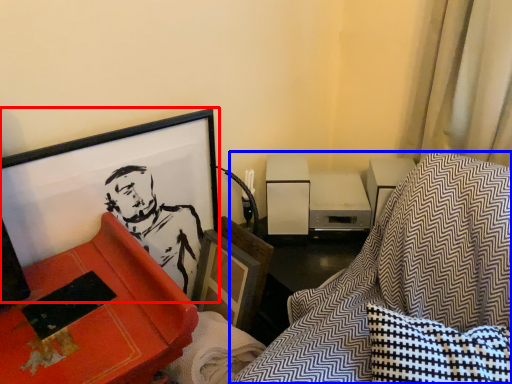
Question: Which of the following is the farthest to the observer, picture frame (highlighted by a red box) or swivel chair (highlighted by a blue box)?

Choices:
 (A) picture frame
 (B) swivel chair

Answer: (A)